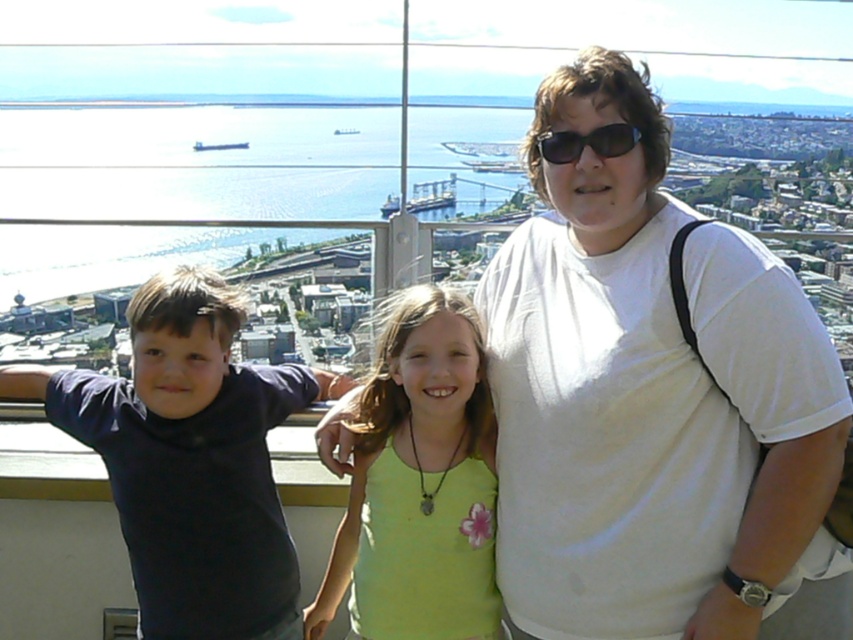
You are a photographer trying to capture a group photo of the dark blue shirt at left and the green fabric shirt at center. Based on their positions, which one should you position closer to the left side of the frame to ensure they are both in the shot?

The dark blue shirt at left is already positioned to the left of the green fabric shirt at center, so you should keep the dark blue shirt at left on the left side of the frame and the green fabric shirt at center in the center to maintain their natural positions.

You are a photographer trying to capture a photo of the family. You notice the white cotton shirt at center and the green fabric shirt at center. Which shirt should you focus on to ensure it appears larger in the photo?

The white cotton shirt at center is closer to the viewer than the green fabric shirt at center, so focusing on it will make it appear larger in the photo.